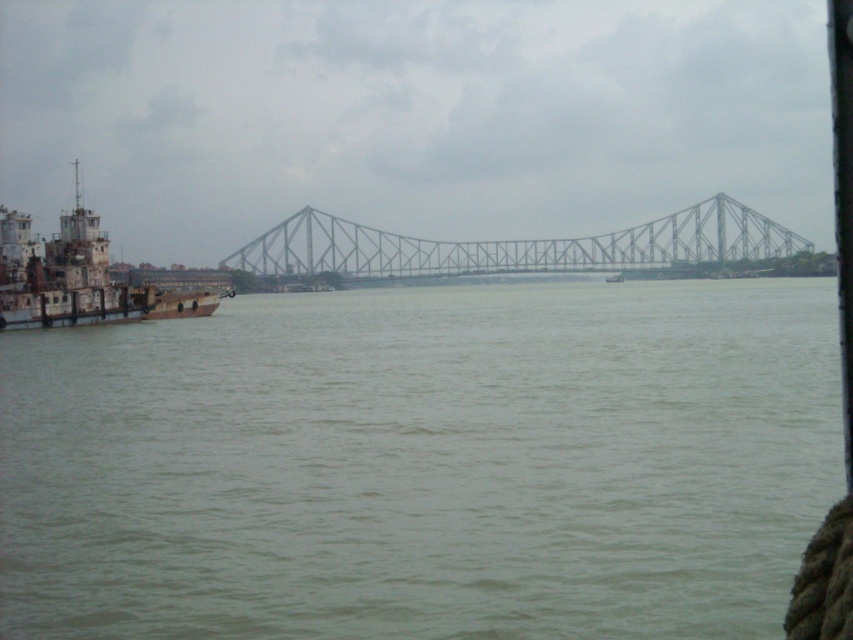
You are standing on a platform observing the metallic gray bridge at center. You want to cross the river to the opposite bank. If your walking speed is 1.5 meters per second, how many minutes will it take you to reach the bridge?

The metallic gray bridge at center is 196.14 meters away from the viewer. At a walking speed of 1.5 meters per second, it would take approximately 130.76 seconds, which is about 2.18 minutes. Therefore, it will take roughly 2.18 minutes to reach the bridge.